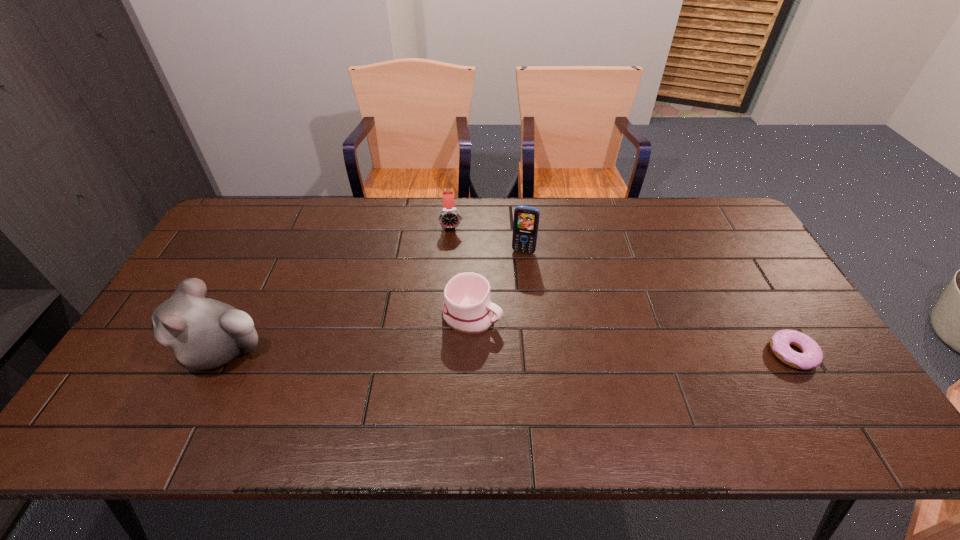
The width and height of the screenshot is (960, 540). In order to click on free space located on the face of the farthest object in this screenshot , I will do (x=458, y=310).

Locate an element on the screen. This screenshot has height=540, width=960. vacant space located on the face of the farthest object is located at coordinates (456, 284).

At what (x,y) coordinates should I click in order to perform the action: click on free spot located 0.200m on the side with the handle of the mug. Please return your answer as a coordinate pair (x, y). This screenshot has height=540, width=960. Looking at the image, I should click on (565, 358).

Locate an element on the screen. vacant position located on the side with the handle of the mug is located at coordinates (632, 389).

Where is `vacant region located on the side with the handle of the mug`? vacant region located on the side with the handle of the mug is located at coordinates (515, 333).

I want to click on vacant space located on the screen of the fourth object from left to right, so click(x=495, y=352).

At what (x,y) coordinates should I click in order to perform the action: click on free location located 0.340m on the screen of the fourth object from left to right. Please return your answer as a coordinate pair (x, y). This screenshot has width=960, height=540. Looking at the image, I should click on (498, 340).

Locate an element on the screen. free region located 0.120m on the screen of the fourth object from left to right is located at coordinates (514, 282).

I want to click on object present at the far edge, so click(x=449, y=217).

Find the location of a particular element. This screenshot has width=960, height=540. hamster that is positioned at the near edge is located at coordinates (203, 333).